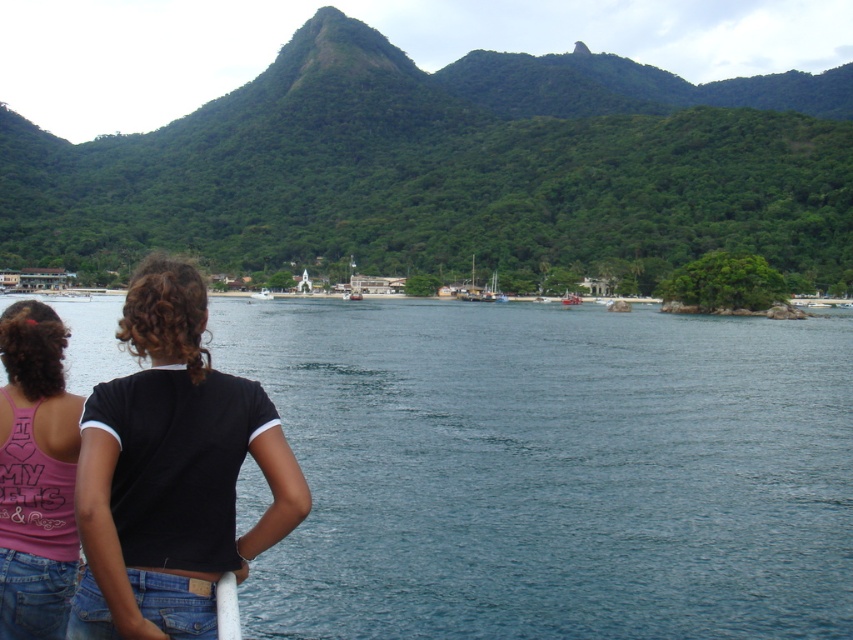
Which of these two, green leafy mountain at upper center or black matte shirt at left, stands taller?

green leafy mountain at upper center

Describe the element at coordinates (451, 168) in the screenshot. I see `green leafy mountain at upper center` at that location.

The width and height of the screenshot is (853, 640). What are the coordinates of `green leafy mountain at upper center` in the screenshot? It's located at (451, 168).

Does black matte shirt at left lie behind white matte boat at center?

No, it is not.

Is black matte shirt at left thinner than white matte boat at center?

Yes, black matte shirt at left is thinner than white matte boat at center.

Where is `black matte shirt at left`? The width and height of the screenshot is (853, 640). black matte shirt at left is located at coordinates (171, 472).

Locate an element on the screen. black matte shirt at left is located at coordinates (171, 472).

Is green leafy mountain at upper center further to camera compared to pink fabric tank top at lower left?

Yes, it is behind pink fabric tank top at lower left.

Is green leafy mountain at upper center closer to camera compared to pink fabric tank top at lower left?

No.

The height and width of the screenshot is (640, 853). Find the location of `green leafy mountain at upper center`. green leafy mountain at upper center is located at coordinates (451, 168).